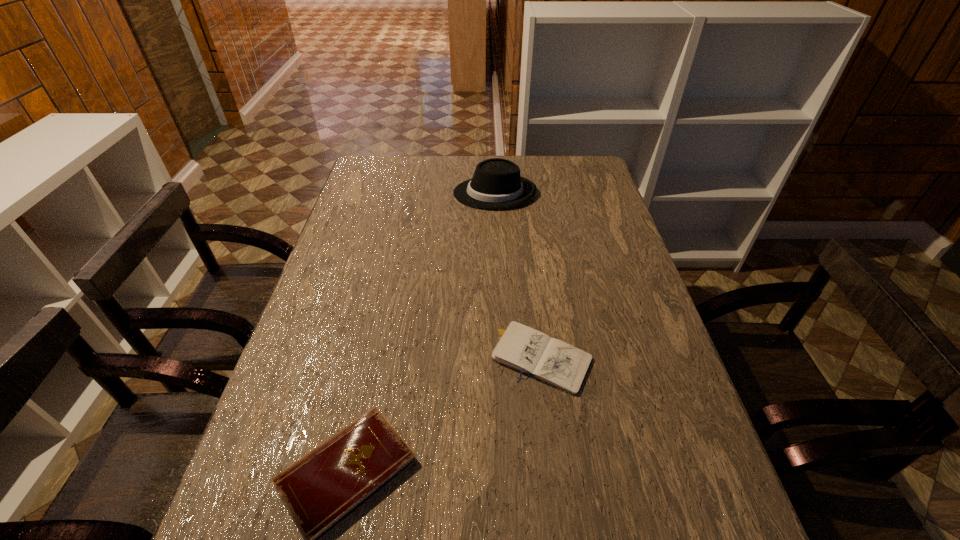
This screenshot has width=960, height=540. I want to click on free space that satisfies the following two spatial constraints: 1. on the front-facing side of the right notebook; 2. on the left side of the fedora, so click(x=502, y=358).

Locate an element on the screen. free spot that satisfies the following two spatial constraints: 1. on the front-facing side of the fedora; 2. on the back side of the second nearest object is located at coordinates (502, 358).

I want to click on vacant space that satisfies the following two spatial constraints: 1. on the front-facing side of the farthest object; 2. on the back side of the farther notebook, so click(502, 358).

Identify the location of vacant position in the image that satisfies the following two spatial constraints: 1. on the front-facing side of the farthest object; 2. on the left side of the second farthest object. (502, 358).

You are a GUI agent. You are given a task and a screenshot of the screen. Output one action in this format:
    pyautogui.click(x=<x>, y=<y>)
    Task: Click on the vacant point that satisfies the following two spatial constraints: 1. on the front-facing side of the right notebook; 2. on the right side of the farthest object
    The height and width of the screenshot is (540, 960).
    Given the screenshot: What is the action you would take?
    pyautogui.click(x=502, y=358)

Image resolution: width=960 pixels, height=540 pixels. Find the location of `vacant space that satisfies the following two spatial constraints: 1. on the back side of the right notebook; 2. on the front-facing side of the farthest object`. vacant space that satisfies the following two spatial constraints: 1. on the back side of the right notebook; 2. on the front-facing side of the farthest object is located at coordinates (521, 193).

The height and width of the screenshot is (540, 960). In order to click on free space that satisfies the following two spatial constraints: 1. on the front-facing side of the farthest object; 2. on the back side of the second nearest object in this screenshot , I will do coord(502,358).

Find the location of a particular element. The height and width of the screenshot is (540, 960). vacant space that satisfies the following two spatial constraints: 1. on the front-facing side of the farther notebook; 2. on the right side of the tallest object is located at coordinates click(502, 358).